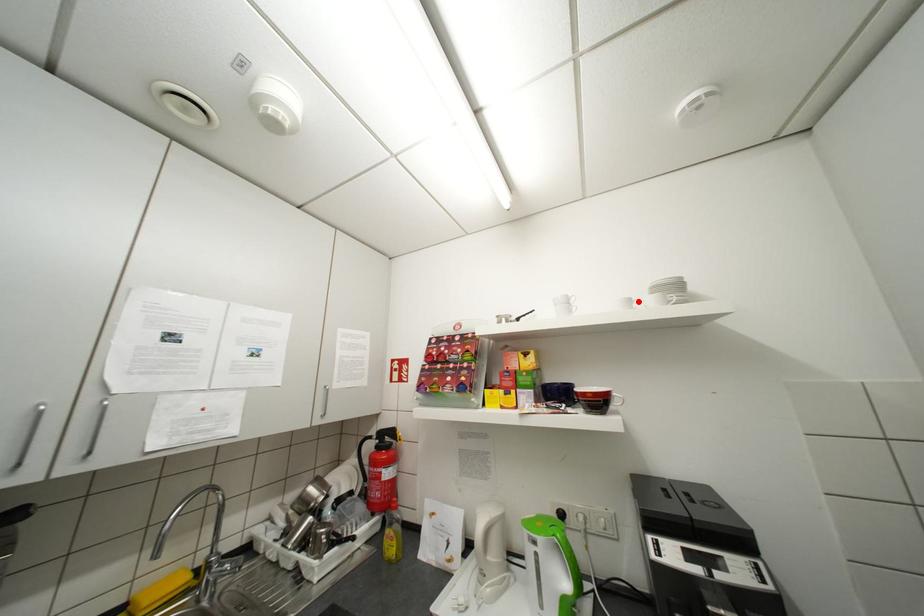
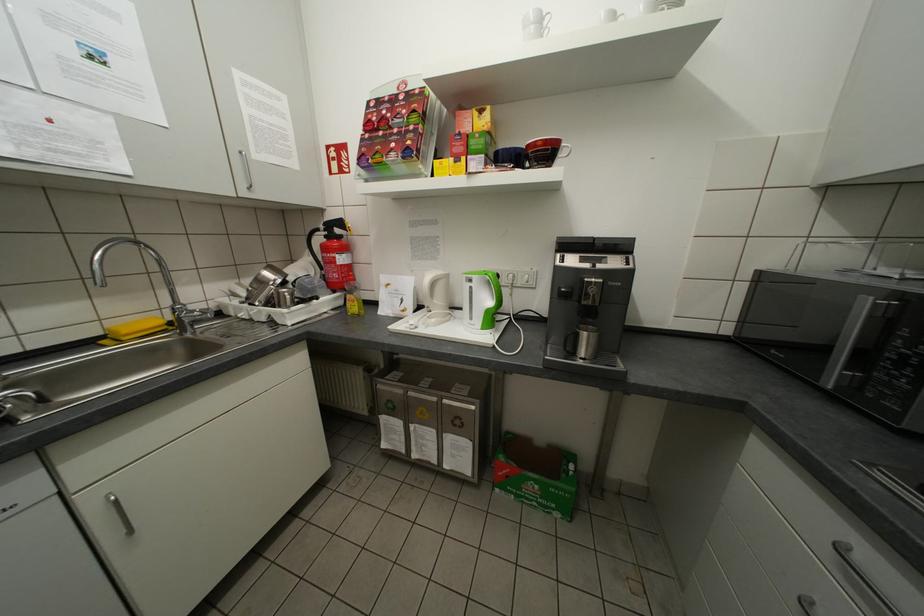
Where in the second image is the point corresponding to the highlighted location from the first image?

(623, 17)